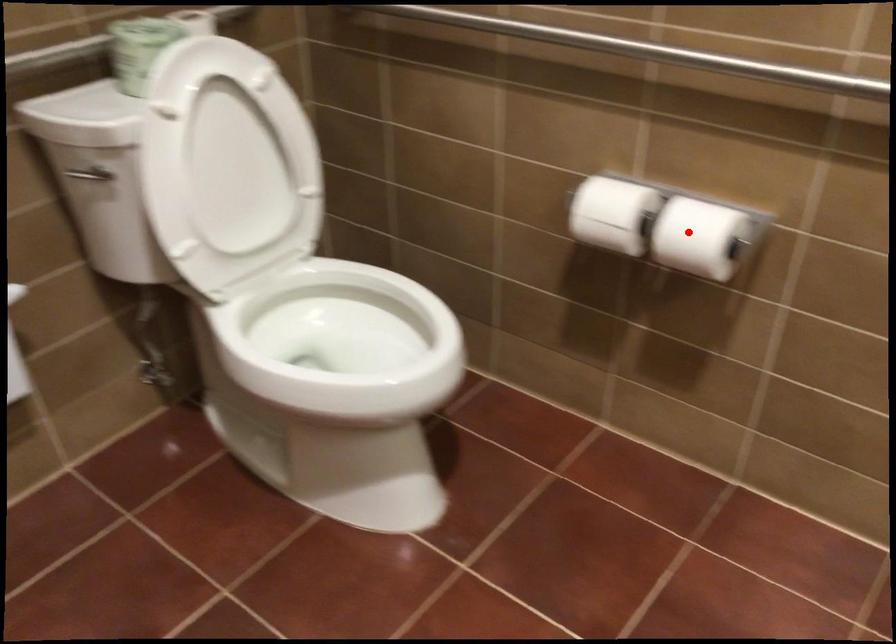
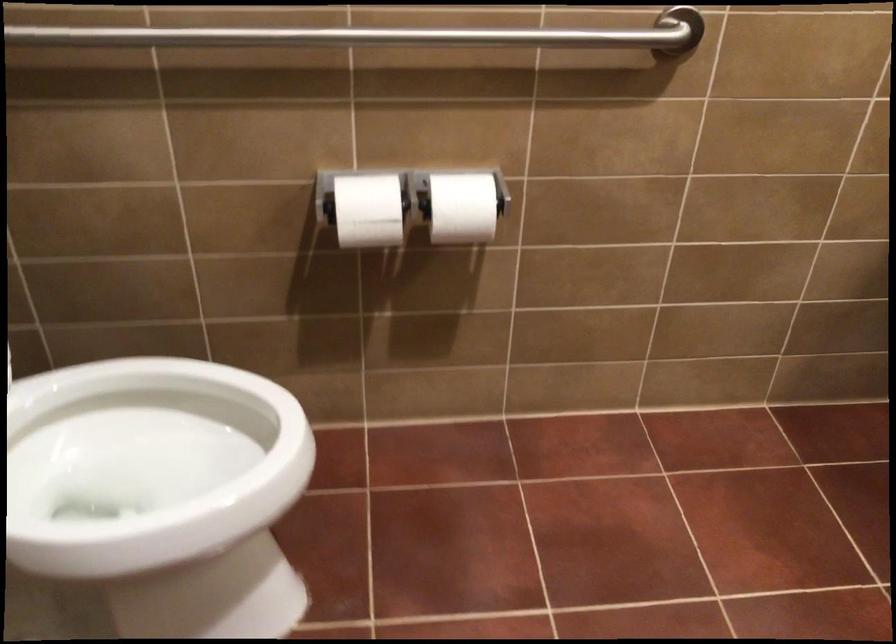
Where in the second image is the point corresponding to the highlighted location from the first image?

(462, 207)